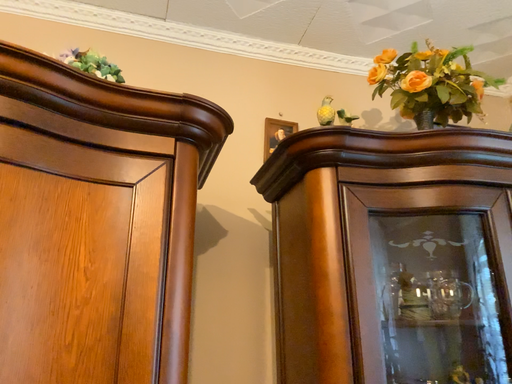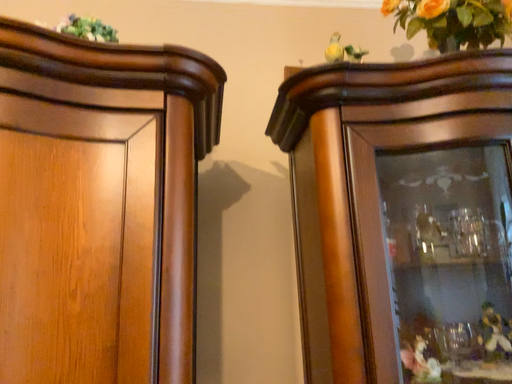
Question: How did the camera likely rotate when shooting the video?

Choices:
 (A) rotated right
 (B) rotated left

Answer: (B)